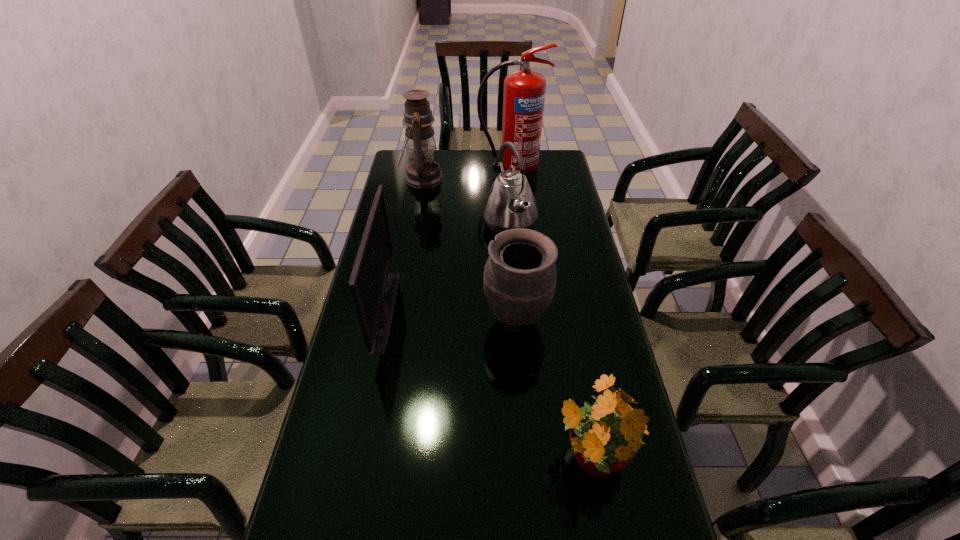
This screenshot has height=540, width=960. Find the location of `vacant space located on the back of the urn`. vacant space located on the back of the urn is located at coordinates (514, 279).

I want to click on free spot located 0.250m on the back of the flowerpot, so click(567, 338).

You are a GUI agent. You are given a task and a screenshot of the screen. Output one action in this format:
    pyautogui.click(x=<x>, y=<y>)
    Task: Click on the fire extinguisher at the far edge
    Image resolution: width=960 pixels, height=540 pixels.
    Given the screenshot: What is the action you would take?
    pyautogui.click(x=524, y=91)

Locate an element on the screen. The height and width of the screenshot is (540, 960). oil lamp at the far edge is located at coordinates [423, 172].

The image size is (960, 540). Identify the location of oil lamp positioned at the left edge. [423, 172].

Identify the location of monitor located in the left edge section of the desktop. The height and width of the screenshot is (540, 960). (374, 289).

At what (x,y) coordinates should I click in order to perform the action: click on fire extinguisher that is at the right edge. Please return your answer as a coordinate pair (x, y). Image resolution: width=960 pixels, height=540 pixels. Looking at the image, I should click on (524, 91).

At what (x,y) coordinates should I click in order to perform the action: click on flowerpot at the right edge. Please return your answer as a coordinate pair (x, y). This screenshot has width=960, height=540. Looking at the image, I should click on (605, 435).

I want to click on object that is at the far left corner, so click(423, 172).

The height and width of the screenshot is (540, 960). I want to click on object present at the far right corner, so click(524, 91).